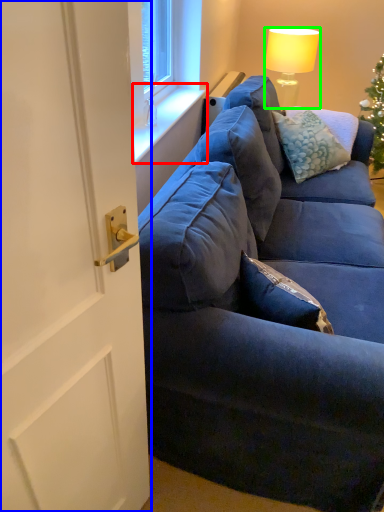
Question: Which object is positioned farthest from window sill (highlighted by a red box)? Select from door (highlighted by a blue box) and lamp (highlighted by a green box).

Choices:
 (A) door
 (B) lamp

Answer: (A)